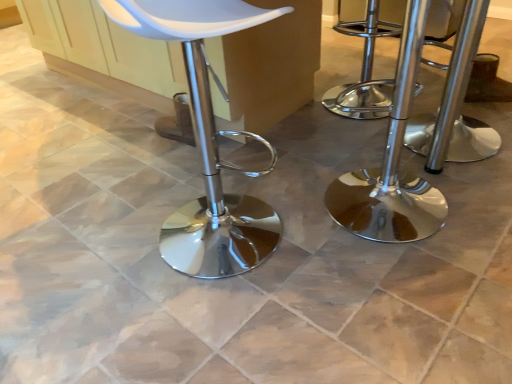
In order to click on free space behind chrome/metallic stool at right, the second stool positioned from the right in this screenshot , I will do `click(345, 152)`.